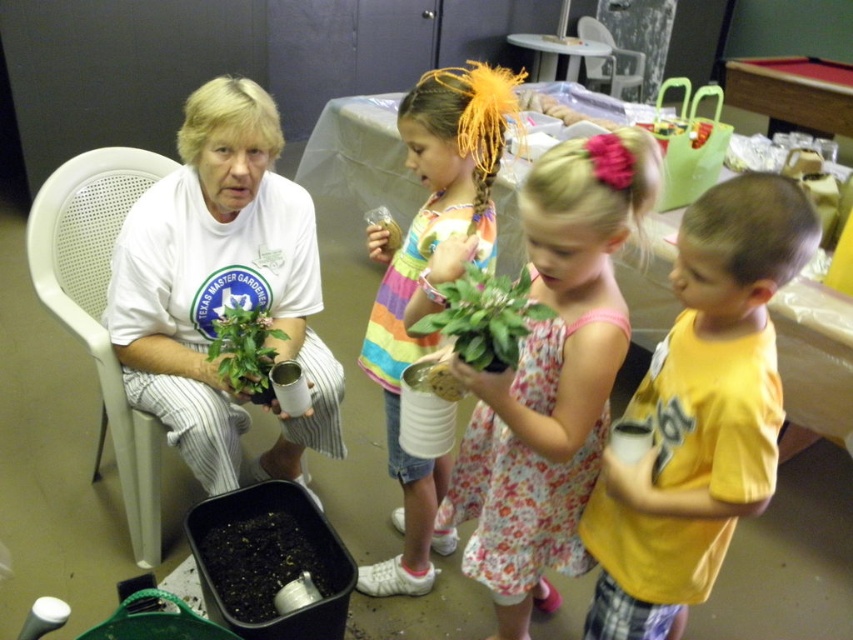
Question: Estimate the real-world distances between objects in this image. Which object is farther from the green matte plant at center?

Choices:
 (A) floral dress at center
 (B) yellow cotton shirt at center
 (C) white matte cup at center
 (D) white plastic chair at upper center

Answer: (D)

Question: Is white matte cup at center below green matte plant at left?

Choices:
 (A) yes
 (B) no

Answer: (A)

Question: Does white matte cup at center have a lesser width compared to pink fabric flower at upper center?

Choices:
 (A) no
 (B) yes

Answer: (A)

Question: Estimate the real-world distances between objects in this image. Which object is farther from the floral dress at center?

Choices:
 (A) white matte t-shirt at left
 (B) white matte cup at center
 (C) white plastic chair at upper center

Answer: (C)

Question: Does yellow cotton shirt at center appear on the left side of white plastic chair at upper center?

Choices:
 (A) yes
 (B) no

Answer: (A)

Question: Which object is the farthest from the pink fabric flower at upper center?

Choices:
 (A) yellow cotton shirt at center
 (B) white matte t-shirt at left
 (C) floral dress at center

Answer: (B)